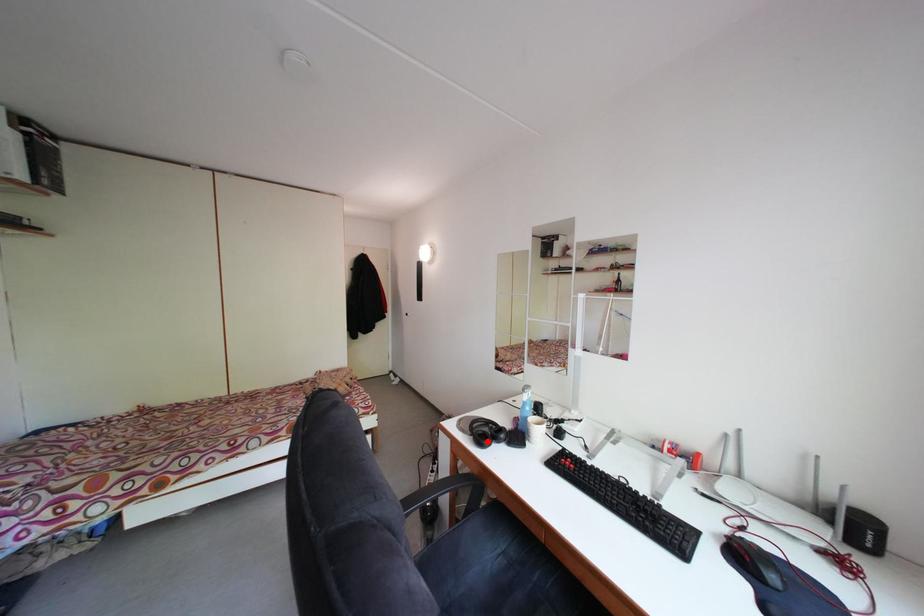
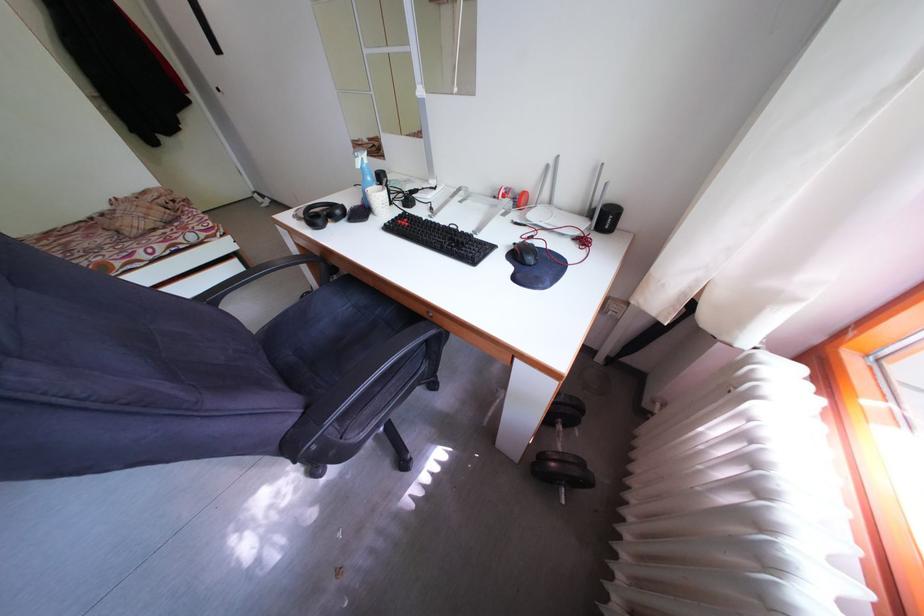
The point at the highlighted location is marked in the first image. Where is the corresponding point in the second image?

(321, 223)